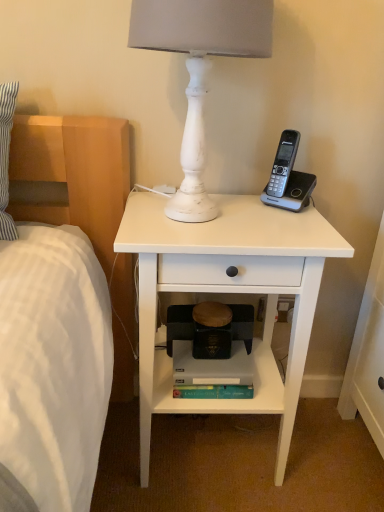
Where is `free space below white distressed wood lamp at upper center (from a real-world perspective)`? free space below white distressed wood lamp at upper center (from a real-world perspective) is located at coordinates (193, 222).